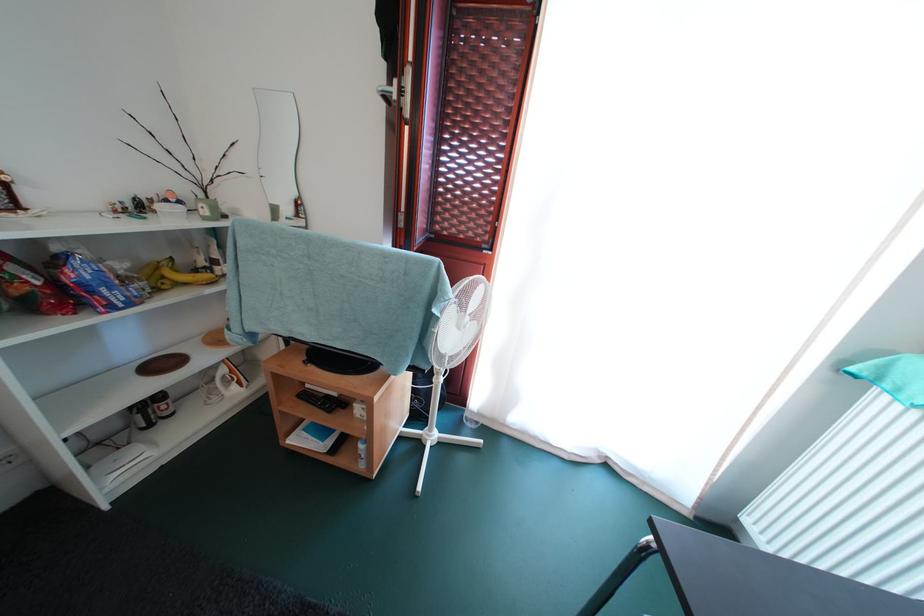
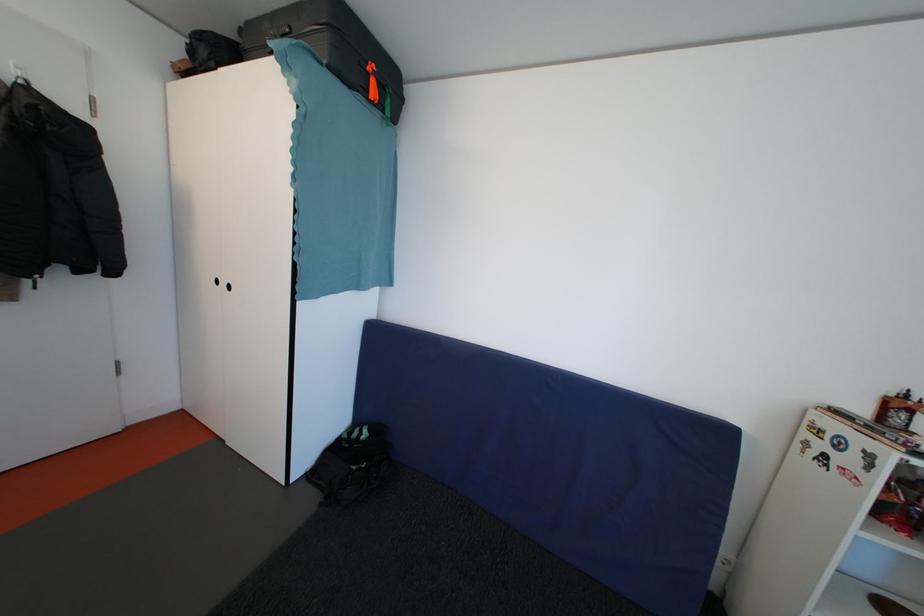
Question: The first image is from the beginning of the video and the second image is from the end. How did the camera likely rotate when shooting the video?

Choices:
 (A) Left
 (B) Right
 (C) Up
 (D) Down

Answer: (A)